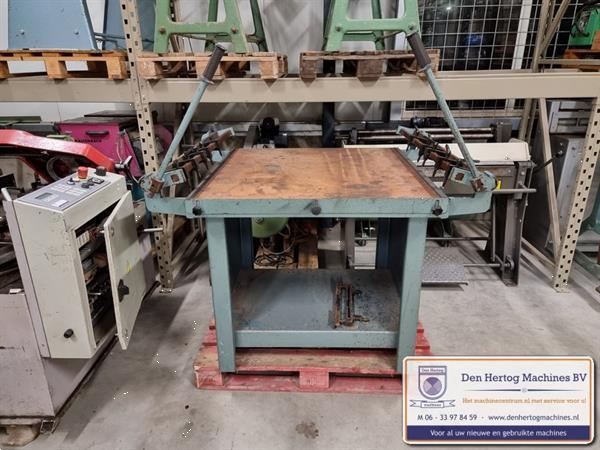
In order to click on door in this screenshot , I will do `click(117, 256)`.